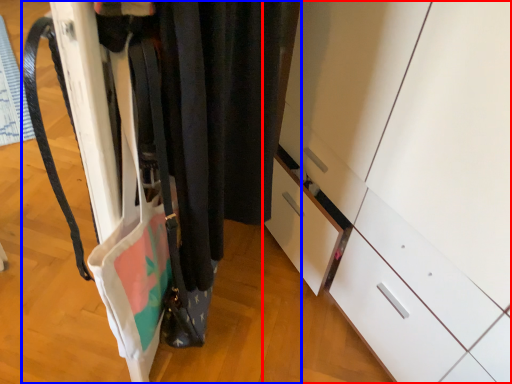
Question: Which of the following is the farthest to the observer, cabinetry (highlighted by a red box) or closet (highlighted by a blue box)?

Choices:
 (A) cabinetry
 (B) closet

Answer: (A)